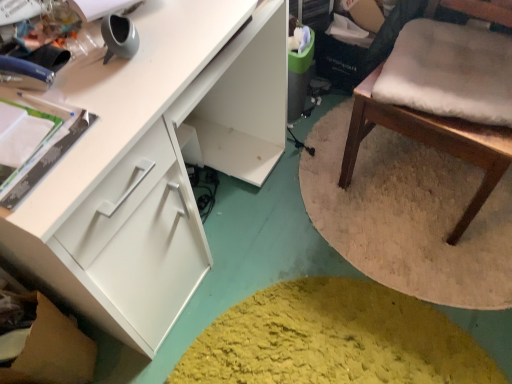
Where is `white matte cabinet at left`? The width and height of the screenshot is (512, 384). white matte cabinet at left is located at coordinates (153, 161).

What do you see at coordinates (153, 161) in the screenshot? I see `white matte cabinet at left` at bounding box center [153, 161].

At what (x,y) coordinates should I click in order to perform the action: click on wooden chair with white cushion at right. Please return your answer as a coordinate pair (x, y). The height and width of the screenshot is (384, 512). Looking at the image, I should click on (431, 142).

The image size is (512, 384). Describe the element at coordinates (431, 142) in the screenshot. I see `wooden chair with white cushion at right` at that location.

Where is `white matte cabinet at left`? This screenshot has width=512, height=384. white matte cabinet at left is located at coordinates tap(153, 161).

Considering the positions of objects wooden chair with white cushion at right and white matte cabinet at left in the image provided, who is more to the left, wooden chair with white cushion at right or white matte cabinet at left?

white matte cabinet at left.

Considering their positions, is wooden chair with white cushion at right located in front of or behind white matte cabinet at left?

wooden chair with white cushion at right is behind white matte cabinet at left.

Considering the positions of point (380, 116) and point (138, 63), is point (380, 116) closer or farther from the camera than point (138, 63)?

Point (380, 116) appears to be farther away from the viewer than point (138, 63).

From the image's perspective, relative to white matte cabinet at left, is wooden chair with white cushion at right above or below?

From the image's perspective, wooden chair with white cushion at right appears above white matte cabinet at left.

From a real-world perspective, does wooden chair with white cushion at right stand above white matte cabinet at left?

Indeed, from a real-world perspective, wooden chair with white cushion at right stands above white matte cabinet at left.

Is wooden chair with white cushion at right wider than white matte cabinet at left?

No.

Considering the relative sizes of wooden chair with white cushion at right and white matte cabinet at left in the image provided, is wooden chair with white cushion at right shorter than white matte cabinet at left?

Incorrect, the height of wooden chair with white cushion at right does not fall short of that of white matte cabinet at left.

Considering the relative sizes of wooden chair with white cushion at right and white matte cabinet at left in the image provided, is wooden chair with white cushion at right smaller than white matte cabinet at left?

Indeed, wooden chair with white cushion at right has a smaller size compared to white matte cabinet at left.

Is wooden chair with white cushion at right situated inside white matte cabinet at left or outside?

The correct answer is: outside.

Are wooden chair with white cushion at right and white matte cabinet at left located far from each other?

No, there isn't a large distance between wooden chair with white cushion at right and white matte cabinet at left.

Is wooden chair with white cushion at right turned away from white matte cabinet at left?

wooden chair with white cushion at right does not have its back to white matte cabinet at left.

Find the location of a particular element. chair lying above the white matte cabinet at left (from the image's perspective) is located at coordinates (431, 142).

Between white matte cabinet at left and wooden chair with white cushion at right, which one appears on the right side from the viewer's perspective?

wooden chair with white cushion at right.

Between white matte cabinet at left and wooden chair with white cushion at right, which one is positioned in front?

Positioned in front is white matte cabinet at left.

Which is nearer, (138, 336) or (351, 172)?

The point (138, 336) is in front.

From the image's perspective, who appears lower, white matte cabinet at left or wooden chair with white cushion at right?

From the image's view, white matte cabinet at left is below.

From a real-world perspective, between white matte cabinet at left and wooden chair with white cushion at right, who is vertically higher?

wooden chair with white cushion at right, from a real-world perspective.

Considering the sizes of objects white matte cabinet at left and wooden chair with white cushion at right in the image provided, who is wider, white matte cabinet at left or wooden chair with white cushion at right?

With larger width is white matte cabinet at left.

Based on the photo, considering the relative sizes of white matte cabinet at left and wooden chair with white cushion at right in the image provided, is white matte cabinet at left shorter than wooden chair with white cushion at right?

Indeed, white matte cabinet at left has a lesser height compared to wooden chair with white cushion at right.

Does white matte cabinet at left have a smaller size compared to wooden chair with white cushion at right?

No.

Would you say white matte cabinet at left contains wooden chair with white cushion at right?

Actually, wooden chair with white cushion at right is outside white matte cabinet at left.

Looking at this image, is white matte cabinet at left touching wooden chair with white cushion at right?

No, white matte cabinet at left is not touching wooden chair with white cushion at right.

Looking at this image, is white matte cabinet at left facing towards wooden chair with white cushion at right?

Yes, white matte cabinet at left is aimed at wooden chair with white cushion at right.

What's the angular difference between white matte cabinet at left and wooden chair with white cushion at right's facing directions?

The facing directions of white matte cabinet at left and wooden chair with white cushion at right are 90.3 degrees apart.

This screenshot has height=384, width=512. In order to click on chair that is above the white matte cabinet at left (from the image's perspective) in this screenshot , I will do `click(431, 142)`.

At what (x,y) coordinates should I click in order to perform the action: click on cabinetry in front of the wooden chair with white cushion at right. Please return your answer as a coordinate pair (x, y). Looking at the image, I should click on (153, 161).

You are a GUI agent. You are given a task and a screenshot of the screen. Output one action in this format:
    pyautogui.click(x=<x>, y=<y>)
    Task: Click on the cabinetry below the wooden chair with white cushion at right (from a real-world perspective)
    
    Given the screenshot: What is the action you would take?
    pyautogui.click(x=153, y=161)